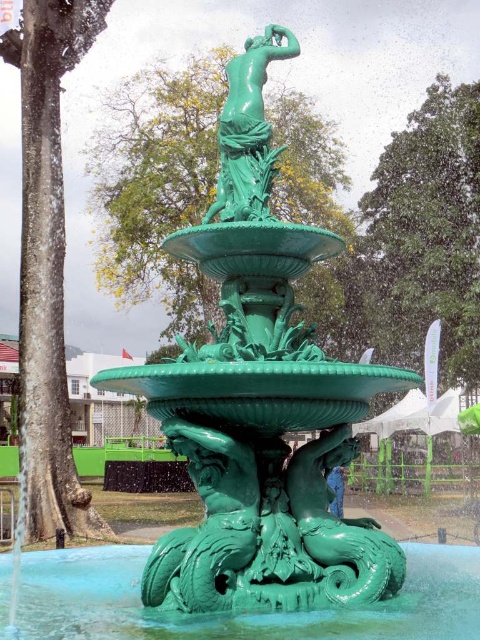
You are standing in a park and see the green polished fountain at center. If you take one step forward, will you be closer than 10 feet to the fountain?

The green polished fountain at center is 11.17 feet away from viewer. If you take one step forward, you will be closer than 10 feet to the fountain.

You are standing in front of the fountain and want to place a small flower pot on the green polished fountain at center. Can you place it directly on the green glossy water at center instead?

The green polished fountain at center is located above the green glossy water at center, so you cannot place the flower pot directly on the water as it is below the fountain.